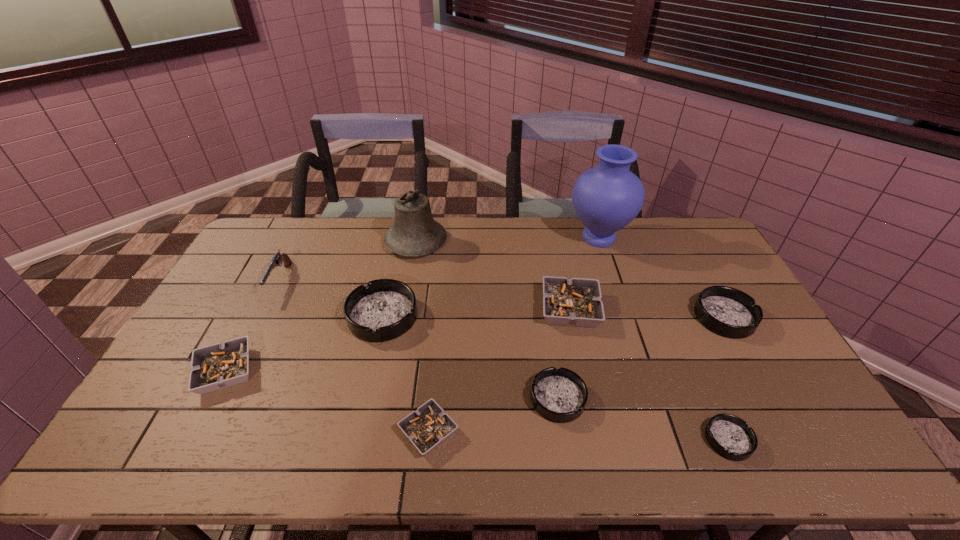
The height and width of the screenshot is (540, 960). Identify the location of vacant area situated 0.290m on the left of the biggest gray ashtray. (447, 309).

Where is `vacant space situated 0.190m on the back of the rightmost ashtray`? Image resolution: width=960 pixels, height=540 pixels. vacant space situated 0.190m on the back of the rightmost ashtray is located at coordinates (692, 259).

Identify the location of free space located 0.150m on the front of the leftmost gray ashtray. (181, 456).

Identify the location of free space located on the back of the third biggest dark ashtray. This screenshot has height=540, width=960. (547, 328).

The width and height of the screenshot is (960, 540). I want to click on vacant space positioned on the right of the nearest gray ashtray, so click(561, 432).

In order to click on free space located on the back of the second dark ashtray from right to left in this screenshot , I will do `click(699, 374)`.

Find the location of `vase at the far edge`. vase at the far edge is located at coordinates (606, 198).

What are the coordinates of `bell positioned at the far edge` in the screenshot? It's located at (415, 232).

At what (x,y) coordinates should I click in order to perform the action: click on object that is at the left edge. Please return your answer as a coordinate pair (x, y). This screenshot has height=540, width=960. Looking at the image, I should click on (217, 366).

You are a GUI agent. You are given a task and a screenshot of the screen. Output one action in this format:
    pyautogui.click(x=<x>, y=<y>)
    Task: Click on the object that is at the right edge
    
    Given the screenshot: What is the action you would take?
    (x=726, y=311)